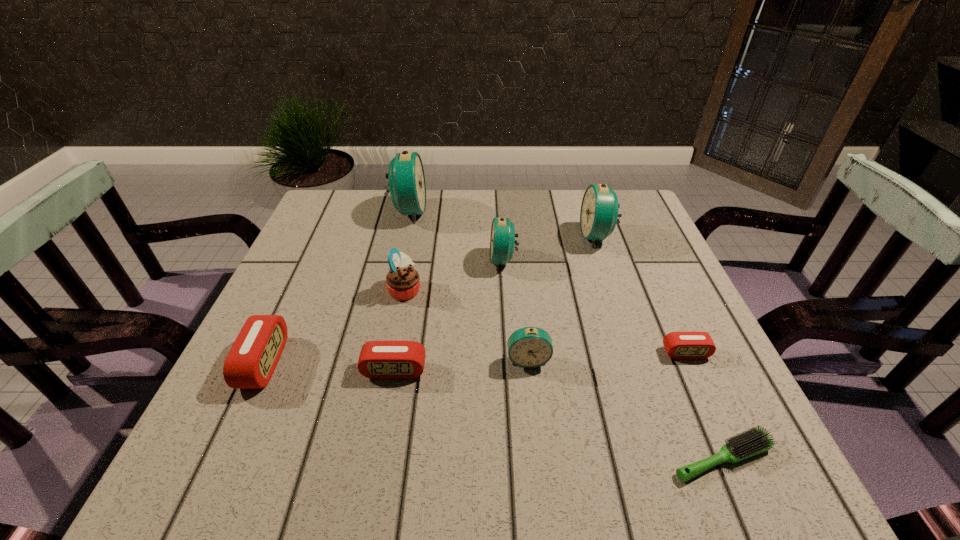
Where is `object located at the near edge`? This screenshot has width=960, height=540. object located at the near edge is located at coordinates (754, 441).

What are the coordinates of `object that is at the left edge` in the screenshot? It's located at (253, 357).

Where is `hairbrush present at the right edge`? The height and width of the screenshot is (540, 960). hairbrush present at the right edge is located at coordinates (754, 441).

You are a GUI agent. You are given a task and a screenshot of the screen. Output one action in this format:
    pyautogui.click(x=<x>, y=<y>)
    Task: Click on the object located in the far right corner section of the desktop
    This screenshot has width=960, height=540.
    Given the screenshot: What is the action you would take?
    pyautogui.click(x=599, y=214)

Where is `object located in the near right corner section of the desktop`? The width and height of the screenshot is (960, 540). object located in the near right corner section of the desktop is located at coordinates (754, 441).

In order to click on vacant space at the far edge in this screenshot , I will do `click(445, 214)`.

You are a GUI agent. You are given a task and a screenshot of the screen. Output one action in this format:
    pyautogui.click(x=<x>, y=<y>)
    Task: Click on the vacant point at the near edge
    The image size is (960, 540).
    Given the screenshot: What is the action you would take?
    pyautogui.click(x=354, y=456)

The width and height of the screenshot is (960, 540). I want to click on vacant space at the left edge of the desktop, so click(x=354, y=267).

Locate an element on the screen. This screenshot has width=960, height=540. vacant region at the right edge of the desktop is located at coordinates (718, 372).

Locate an element on the screen. vacant position at the far left corner of the desktop is located at coordinates (324, 220).